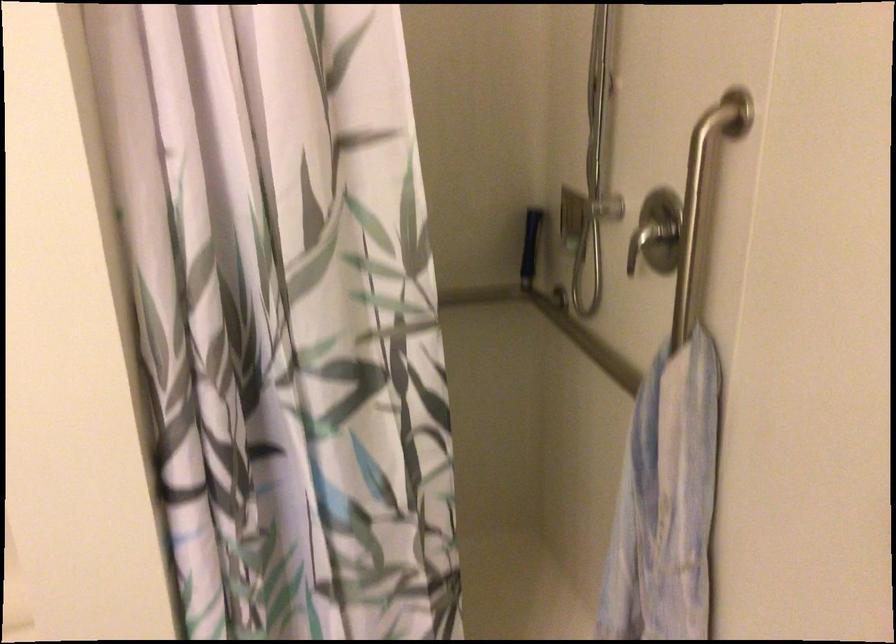
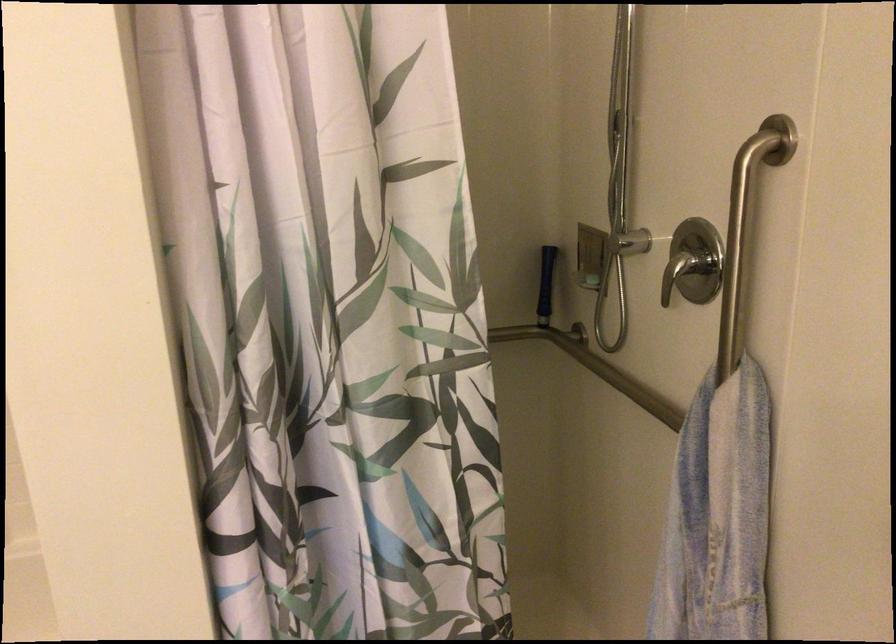
Locate, in the second image, the point that corresponds to (x=529, y=252) in the first image.

(546, 285)